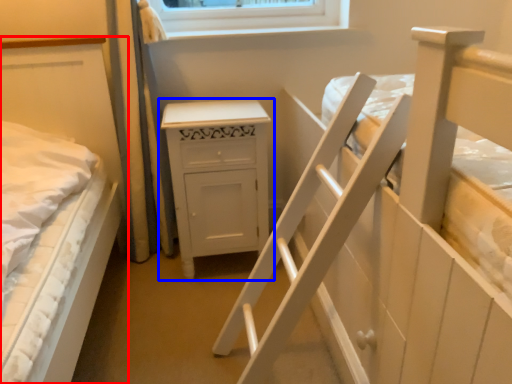
Question: Which point is closer to the camera, bed (highlighted by a red box) or chest of drawers (highlighted by a blue box)?

Choices:
 (A) bed
 (B) chest of drawers

Answer: (A)